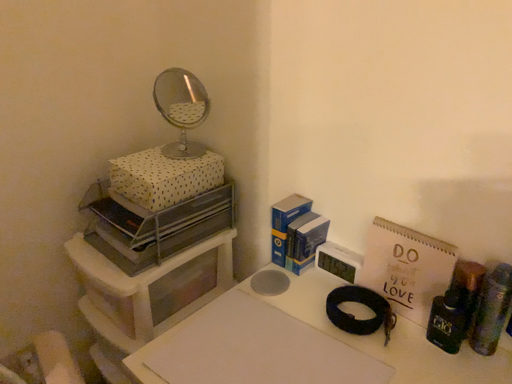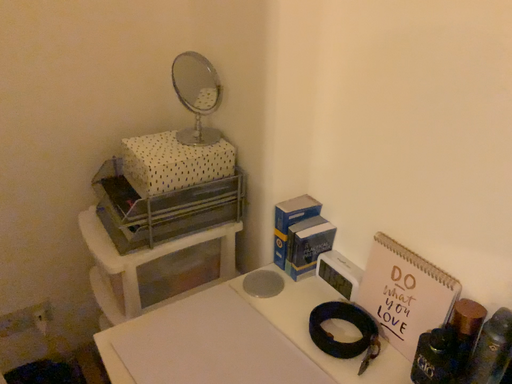
Question: Which way did the camera rotate in the video?

Choices:
 (A) rotated left
 (B) rotated right

Answer: (A)